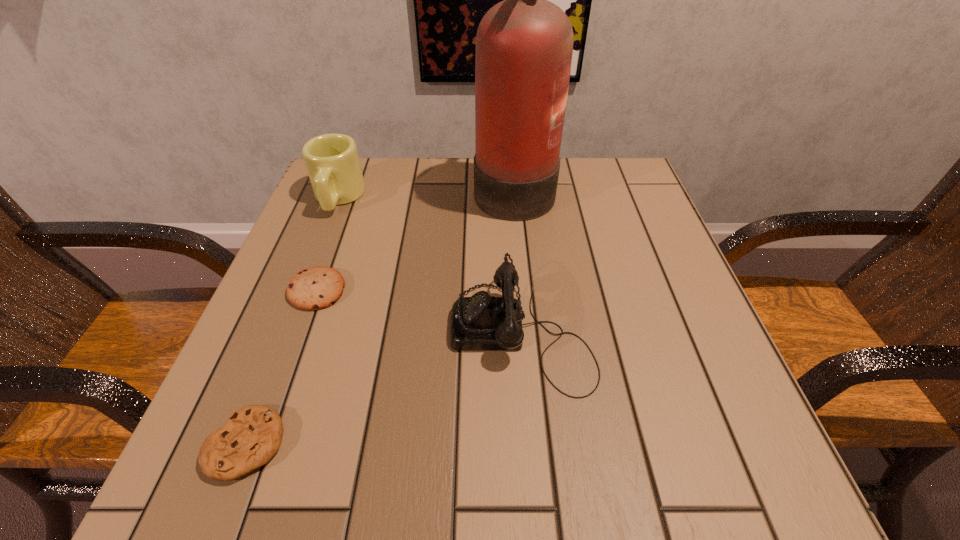
Identify the location of the tallest object. (524, 45).

The height and width of the screenshot is (540, 960). In order to click on the second tallest object in this screenshot , I will do `click(332, 161)`.

You are a GUI agent. You are given a task and a screenshot of the screen. Output one action in this format:
    pyautogui.click(x=<x>, y=<y>)
    Task: Click on the telephone
    
    Given the screenshot: What is the action you would take?
    pyautogui.click(x=481, y=322)

Image resolution: width=960 pixels, height=540 pixels. I want to click on the farther cookie, so click(318, 287).

At what (x,y) coordinates should I click in order to perform the action: click on the nearest object. Please return your answer as a coordinate pair (x, y). Image resolution: width=960 pixels, height=540 pixels. Looking at the image, I should click on (252, 435).

Where is `vacant position located 0.150m at the nozzle of the tallest object`? vacant position located 0.150m at the nozzle of the tallest object is located at coordinates (412, 187).

The width and height of the screenshot is (960, 540). I want to click on vacant position located at the nozzle of the tallest object, so click(362, 187).

This screenshot has width=960, height=540. What are the coordinates of `free space located 0.190m at the nozzle of the tallest object` in the screenshot? It's located at (395, 187).

Image resolution: width=960 pixels, height=540 pixels. Find the location of `vacant area located with the handle on the side of the fourth shortest object`. vacant area located with the handle on the side of the fourth shortest object is located at coordinates (318, 250).

You are a GUI agent. You are given a task and a screenshot of the screen. Output one action in this format:
    pyautogui.click(x=<x>, y=<y>)
    Task: Click on the free spot located 0.150m on the front-facing side of the telephone
    
    Given the screenshot: What is the action you would take?
    pyautogui.click(x=363, y=331)